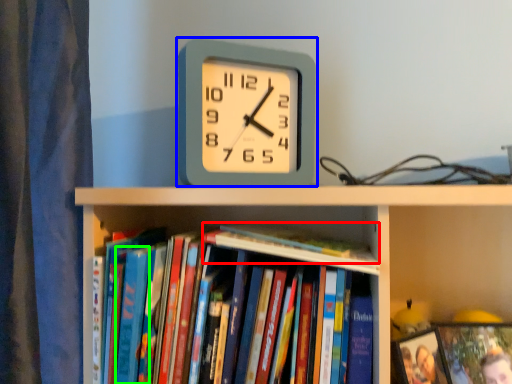
Question: Estimate the real-world distances between objects in this image. Which object is closer to book (highlighted by a red box), wall clock (highlighted by a blue box) or paperback book (highlighted by a green box)?

Choices:
 (A) wall clock
 (B) paperback book

Answer: (A)